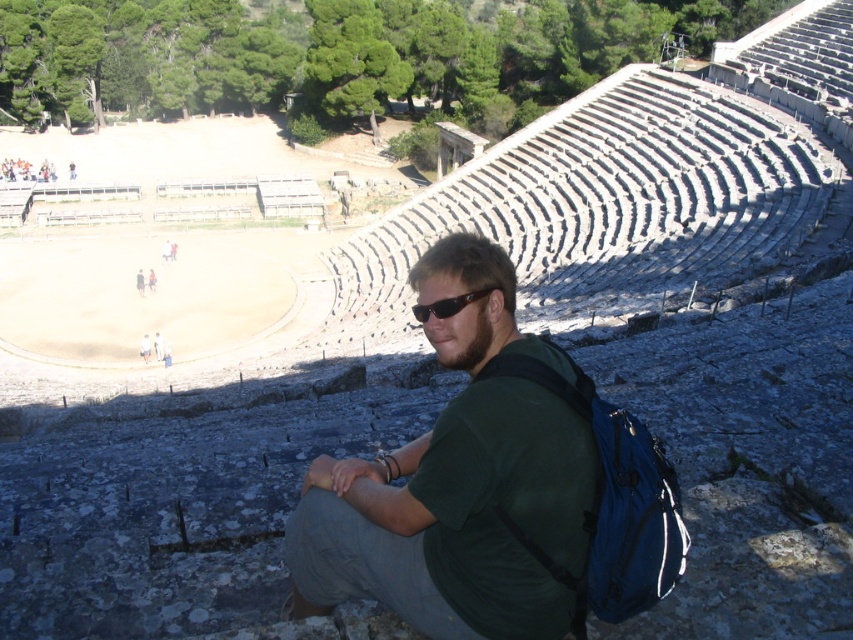
You are a photographer trying to capture a closeup of the green fabric shirt at center and the black plastic sunglasses at center. Since you want both items to appear the same size in the photo, which object should you move closer to the camera and which should you move farther away?

The green fabric shirt at center is larger in size than the black plastic sunglasses at center. To make them appear the same size in the photo, move the green fabric shirt at center farther away from the camera and bring the black plastic sunglasses at center closer. This way, the larger shirt will be smaller in the frame, and the smaller sunglasses will be larger, balancing their sizes.

You are a photographer at the amphitheater and want to capture a closeup of the blue fabric backpack at center and the black plastic sunglasses at center. Which object is located to the right of the other?

The blue fabric backpack at center is positioned on the right side of black plastic sunglasses at center.

You are standing at the entrance of the ancient amphitheater and notice a blue fabric backpack at center and a black plastic sunglasses at center. Which item is nearer to you?

The blue fabric backpack at center is closer to the viewer than the black plastic sunglasses at center.